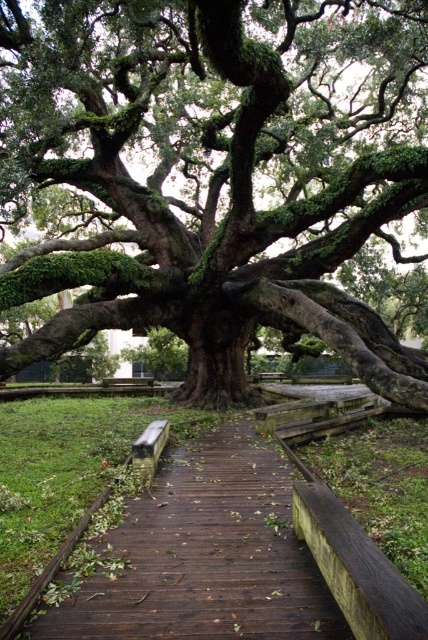
Does green mossy oak tree at center have a lesser height compared to brown wooden path at center?

No.

What do you see at coordinates (213, 173) in the screenshot? I see `green mossy oak tree at center` at bounding box center [213, 173].

You are a GUI agent. You are given a task and a screenshot of the screen. Output one action in this format:
    pyautogui.click(x=<x>, y=<y>)
    Task: Click on the green mossy oak tree at center
    Image resolution: width=428 pixels, height=640 pixels.
    Given the screenshot: What is the action you would take?
    pyautogui.click(x=213, y=173)

Who is more forward, [276,141] or [166,442]?

Point [166,442] is more forward.

Looking at this image, is the position of green mossy oak tree at center more distant than that of wooden park bench at center?

No, it is in front of wooden park bench at center.

Find the location of a particular element. green mossy oak tree at center is located at coordinates (213, 173).

Where is `green mossy oak tree at center`? The height and width of the screenshot is (640, 428). green mossy oak tree at center is located at coordinates (213, 173).

How much distance is there between brown wooden path at center and wooden park bench at center?

brown wooden path at center is 36.60 inches away from wooden park bench at center.

Can you confirm if brown wooden path at center is smaller than wooden park bench at center?

No, brown wooden path at center is not smaller than wooden park bench at center.

Does point (279, 506) lie in front of point (162, 438)?

Yes, it is in front of point (162, 438).

Find the location of a particular element. brown wooden path at center is located at coordinates (x=202, y=556).